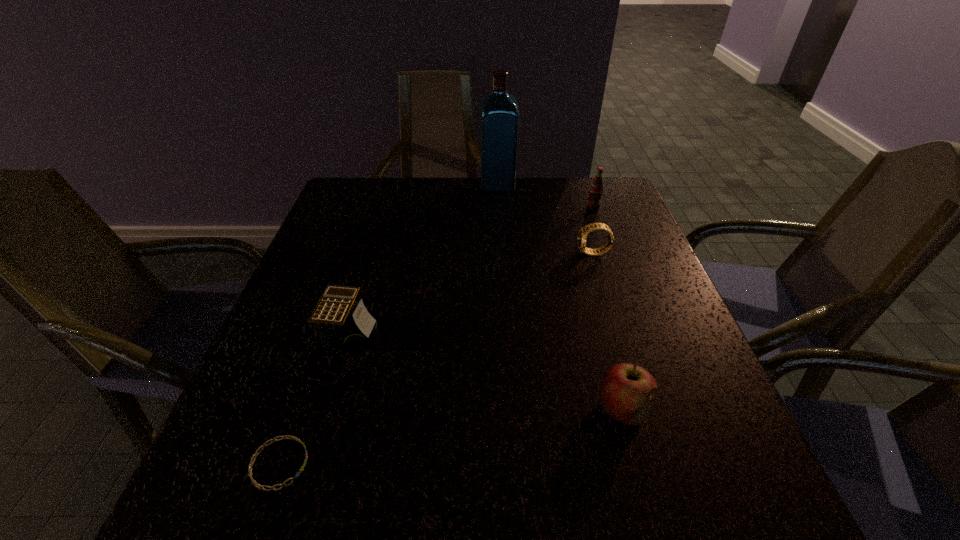
Identify the location of free spot that satisfies the following two spatial constraints: 1. on the flat label side of the farthest object; 2. on the back side of the fifth shortest object. (498, 207).